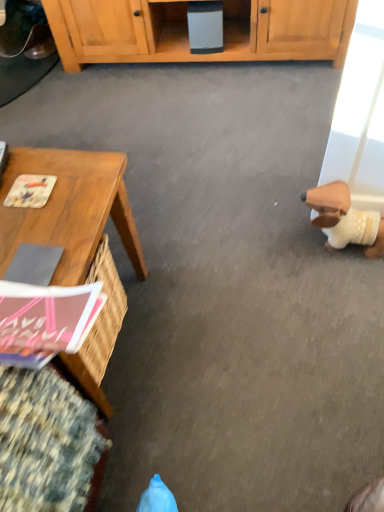
Question: Should I look upward or downward to see brown plush toy at right?

Choices:
 (A) up
 (B) down

Answer: (A)

Question: Is pink matte magazine at lower left, the second magazine when ordered from back to front, at the left side of brown plush toy at right?

Choices:
 (A) no
 (B) yes

Answer: (B)

Question: Could you tell me if pink matte magazine at lower left, which ranks as the first magazine in bottom-to-top order, is facing brown plush toy at right?

Choices:
 (A) no
 (B) yes

Answer: (A)

Question: Is pink matte magazine at lower left, which ranks as the first magazine in bottom-to-top order, positioned in front of brown plush toy at right?

Choices:
 (A) no
 (B) yes

Answer: (B)

Question: Can you confirm if pink matte magazine at lower left, which is the second magazine from top to bottom, is shorter than brown plush toy at right?

Choices:
 (A) yes
 (B) no

Answer: (A)

Question: Is the position of pink matte magazine at lower left, which ranks as the first magazine in bottom-to-top order, more distant than that of brown plush toy at right?

Choices:
 (A) no
 (B) yes

Answer: (A)

Question: Is pink matte magazine at lower left, which ranks as the first magazine in bottom-to-top order, far away from brown plush toy at right?

Choices:
 (A) no
 (B) yes

Answer: (A)

Question: Is wooden desk at left wider than brown plush toy at right?

Choices:
 (A) yes
 (B) no

Answer: (A)

Question: From the image's perspective, is wooden desk at left above brown plush toy at right?

Choices:
 (A) yes
 (B) no

Answer: (B)

Question: Does wooden desk at left appear on the right side of brown plush toy at right?

Choices:
 (A) no
 (B) yes

Answer: (A)

Question: Are wooden desk at left and brown plush toy at right making contact?

Choices:
 (A) no
 (B) yes

Answer: (A)

Question: Can we say wooden desk at left lies outside brown plush toy at right?

Choices:
 (A) yes
 (B) no

Answer: (A)

Question: Is brown plush toy at right surrounded by wooden desk at left?

Choices:
 (A) yes
 (B) no

Answer: (B)

Question: Is brown plush toy at right bigger than wooden desk at left?

Choices:
 (A) yes
 (B) no

Answer: (B)